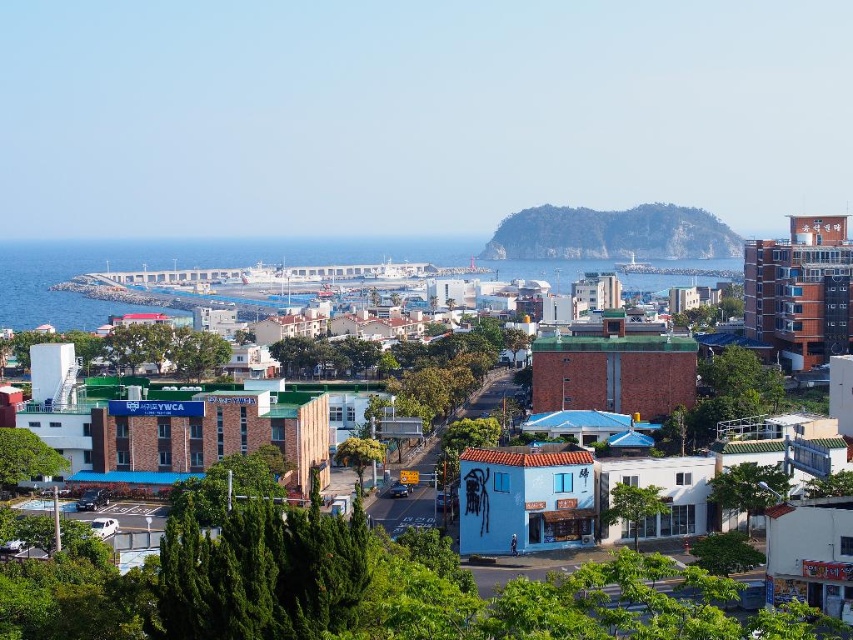
From the picture: You are a tourist standing at the edge of the street in the coastal town. You want to take a photo of the brown brick building at center and the blue concrete water at center together in the same frame. Based on their distance apart, do you think you can capture both in a single photo without moving your camera position?

The brown brick building at center is 282.37 meters away from the blue concrete water at center. Since they are relatively far apart, capturing both in a single frame without moving the camera might be challenging unless using a wide angle lens. However, the exact feasibility depends on the camera lens and your current position.

You are standing at the viewpoint of the image and want to walk towards both the point at coordinates point (117, 300) and the point at coordinates point (534, 237). Which point will you reach first?

You will reach the point at coordinates point (117, 300) first because it is closer to you than the point at coordinates point (534, 237).

You are a delivery driver who needs to navigate through the narrowest part of the street between the brown brick building at center and the green rocky island at center. The delivery truck is 3 meters wide. Can you safely pass through this section?

The brown brick building at center is thinner than the green rocky island at center, but the description does not provide exact measurements of the width between them. Without knowing the actual width of the path, it is impossible to determine if the 3 meter wide delivery truck can safely pass through.